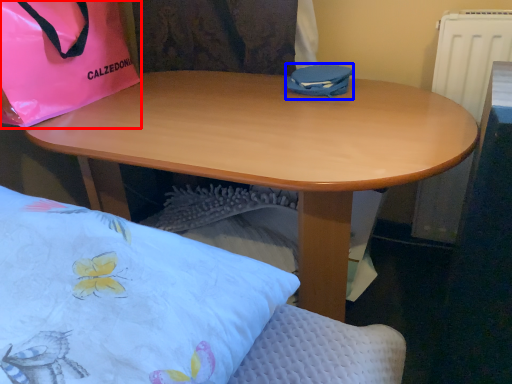
Question: Among these objects, which one is farthest to the camera, handbag (highlighted by a red box) or bag (highlighted by a blue box)?

Choices:
 (A) handbag
 (B) bag

Answer: (B)